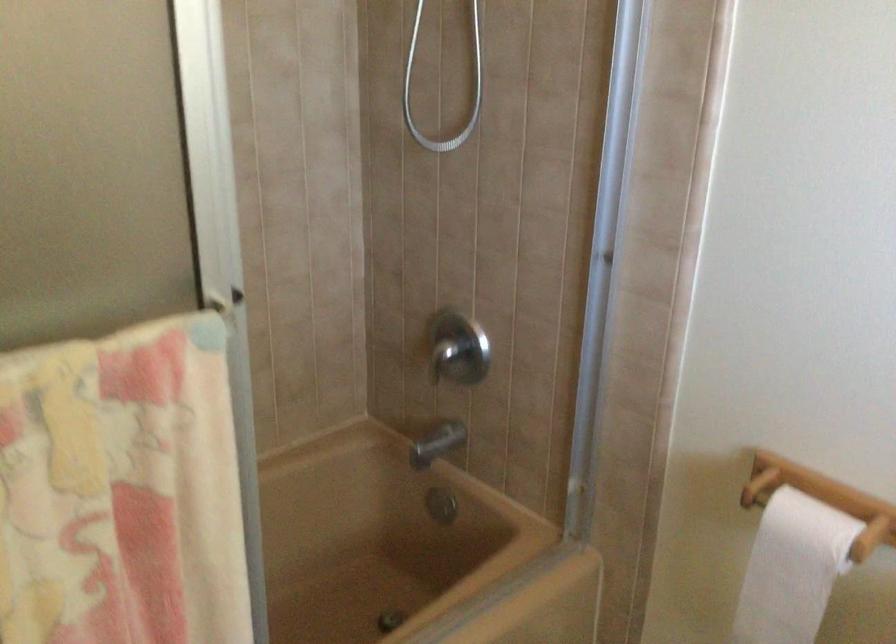
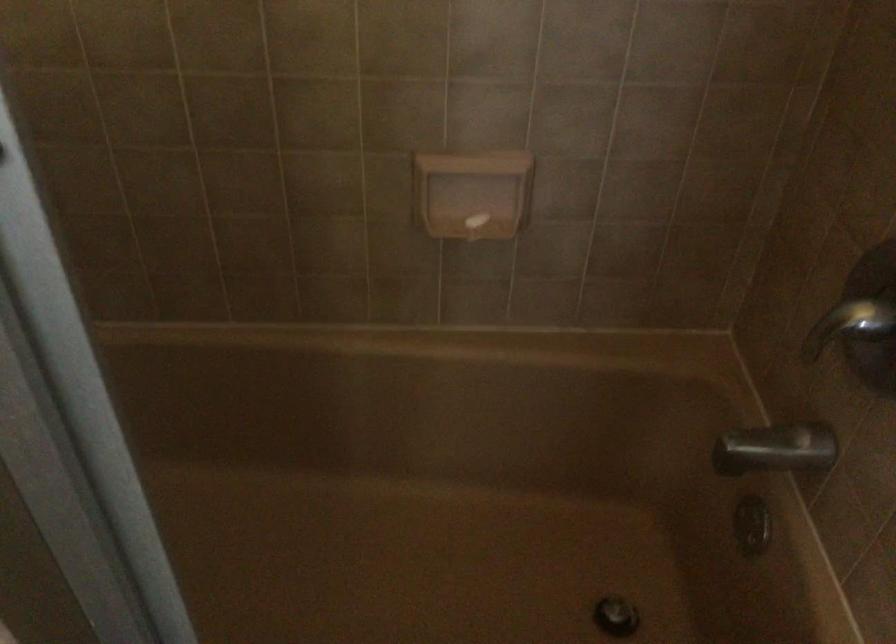
The point at [443,444] is marked in the first image. Where is the corresponding point in the second image?

(776, 449)